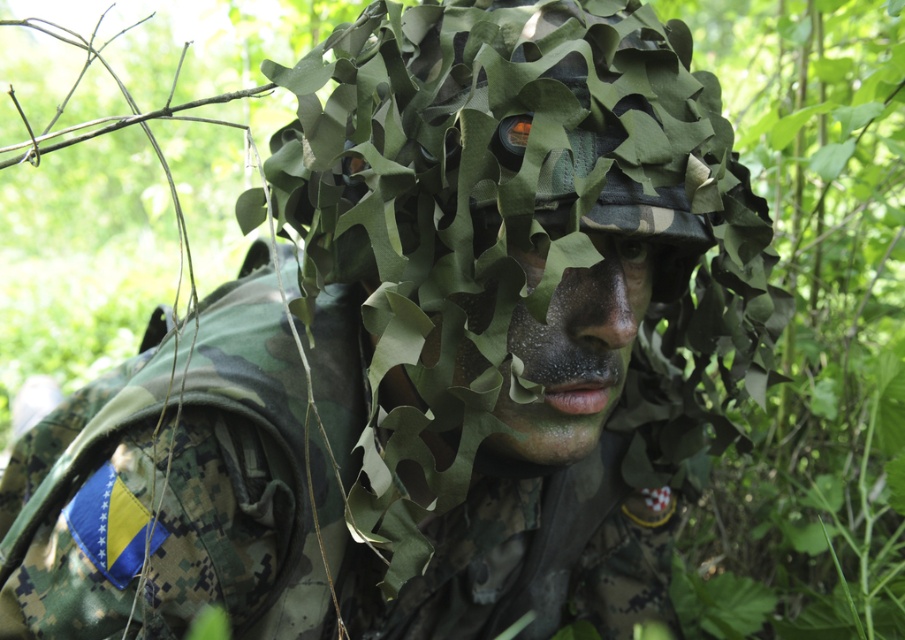
Question: Can you confirm if green leafy netting at center is thinner than camouflage netting at center?

Choices:
 (A) no
 (B) yes

Answer: (A)

Question: Which object is farther from the camera taking this photo?

Choices:
 (A) camouflage netting at center
 (B) green leafy netting at center

Answer: (A)

Question: Does green leafy netting at center have a larger size compared to camouflage netting at center?

Choices:
 (A) no
 (B) yes

Answer: (B)

Question: Which of the following is the farthest from the observer?

Choices:
 (A) green leafy netting at center
 (B) camouflage netting at center

Answer: (B)

Question: Can you confirm if green leafy netting at center is positioned above camouflage netting at center?

Choices:
 (A) no
 (B) yes

Answer: (B)